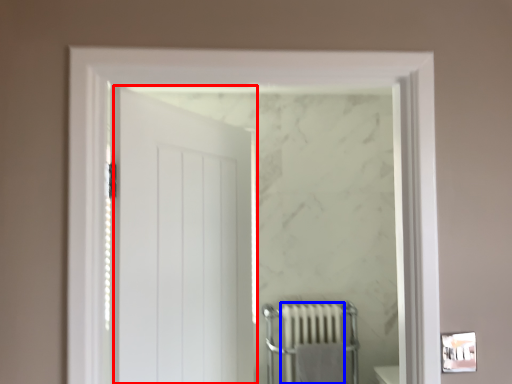
Question: Which point is closer to the camera, door (highlighted by a red box) or radiator (highlighted by a blue box)?

Choices:
 (A) door
 (B) radiator

Answer: (A)